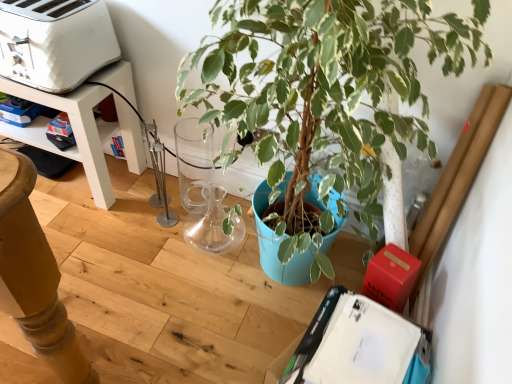
Question: Is green variegated leaf at center directly adjacent to white plastic toaster at upper left?

Choices:
 (A) no
 (B) yes

Answer: (A)

Question: Does green variegated leaf at center come in front of white plastic toaster at upper left?

Choices:
 (A) yes
 (B) no

Answer: (A)

Question: Can white plastic toaster at upper left be found inside green variegated leaf at center?

Choices:
 (A) yes
 (B) no

Answer: (B)

Question: Is green variegated leaf at center looking in the opposite direction of white plastic toaster at upper left?

Choices:
 (A) yes
 (B) no

Answer: (B)

Question: Is green variegated leaf at center facing towards white plastic toaster at upper left?

Choices:
 (A) yes
 (B) no

Answer: (B)

Question: From a real-world perspective, is green variegated leaf at center located higher than white plastic toaster at upper left?

Choices:
 (A) yes
 (B) no

Answer: (B)

Question: Is white plastic toaster at upper left bigger than green variegated leaf at center?

Choices:
 (A) no
 (B) yes

Answer: (A)

Question: Does white plastic toaster at upper left have a greater width compared to green variegated leaf at center?

Choices:
 (A) yes
 (B) no

Answer: (B)

Question: Is white plastic toaster at upper left thinner than green variegated leaf at center?

Choices:
 (A) yes
 (B) no

Answer: (A)

Question: Is white plastic toaster at upper left positioned beyond the bounds of green variegated leaf at center?

Choices:
 (A) no
 (B) yes

Answer: (B)

Question: From a real-world perspective, is white plastic toaster at upper left located beneath green variegated leaf at center?

Choices:
 (A) no
 (B) yes

Answer: (A)

Question: Can you confirm if white plastic toaster at upper left is shorter than green variegated leaf at center?

Choices:
 (A) no
 (B) yes

Answer: (B)

Question: Considering the positions of white plastic toaster at upper left and green variegated leaf at center in the image, is white plastic toaster at upper left taller or shorter than green variegated leaf at center?

Choices:
 (A) short
 (B) tall

Answer: (A)